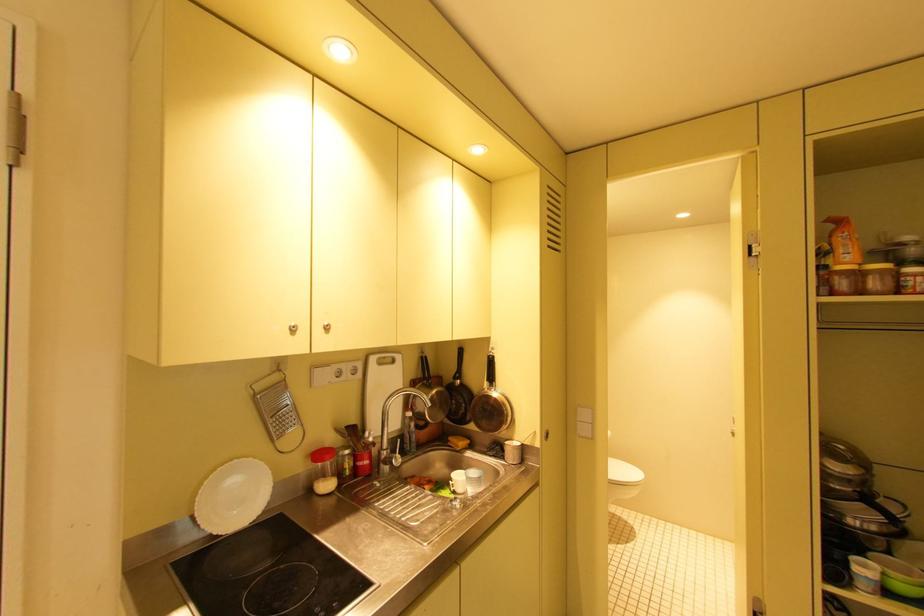
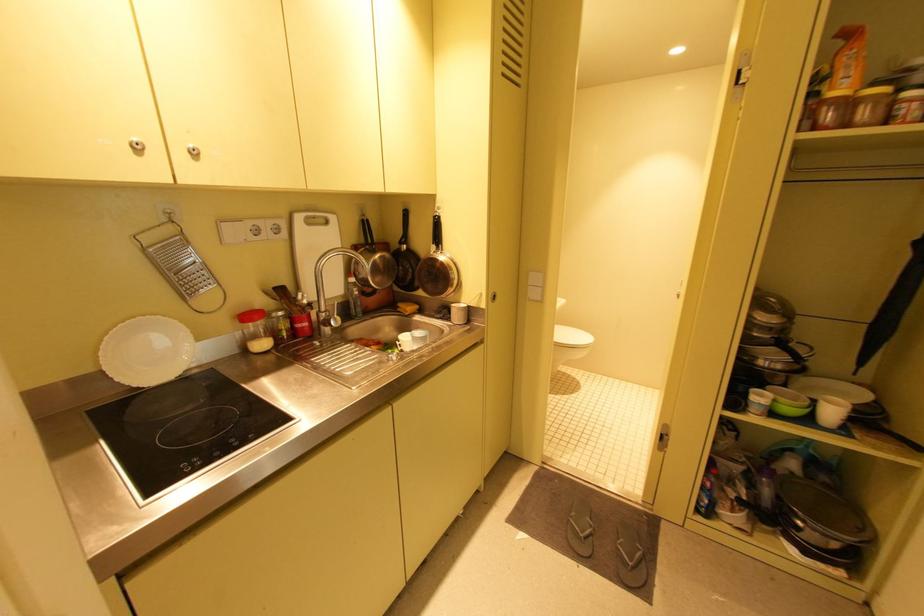
Question: Based on the continuous images, in which direction is the camera rotating? Reply with the corresponding letter.

Choices:
 (A) Left
 (B) Right
 (C) Up
 (D) Down

Answer: (D)